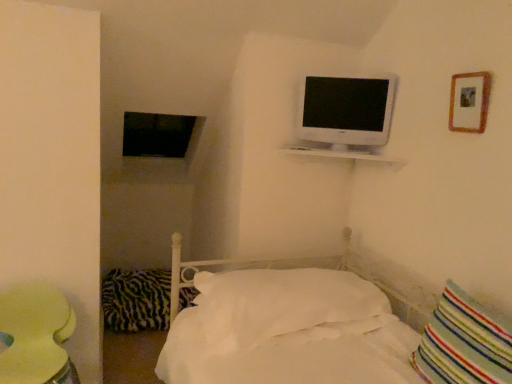
How much space does striped fabric pillow at lower right, which is the third pillow in back-to-front order, occupy horizontally?

striped fabric pillow at lower right, which is the third pillow in back-to-front order, is 8.17 inches wide.

What do you see at coordinates (285, 307) in the screenshot? I see `white soft pillow at center, placed as the second pillow when sorted from right to left` at bounding box center [285, 307].

What do you see at coordinates (469, 102) in the screenshot? I see `wooden picture frame at upper right` at bounding box center [469, 102].

What do you see at coordinates (136, 299) in the screenshot? I see `zebra-patterned fabric pillow at lower left, the third pillow when ordered from right to left` at bounding box center [136, 299].

This screenshot has width=512, height=384. What do you see at coordinates (346, 111) in the screenshot?
I see `white glossy television at upper right` at bounding box center [346, 111].

In order to click on striped fabric pillow at lower right, positioned as the first pillow in front-to-back order in this screenshot , I will do `click(464, 343)`.

Which is in front, point (380, 130) or point (351, 152)?

The point (380, 130) is closer.

From the image's perspective, is white glossy television at upper right beneath white glossy shelf at upper center?

Actually, white glossy television at upper right appears above white glossy shelf at upper center in the image.

Is white glossy television at upper right wider or thinner than white glossy shelf at upper center?

Considering their sizes, white glossy television at upper right looks slimmer than white glossy shelf at upper center.

Considering the positions of point (386, 78) and point (113, 279), is point (386, 78) closer or farther from the camera than point (113, 279)?

Clearly, point (386, 78) is closer to the camera than point (113, 279).

Can you confirm if white glossy television at upper right is smaller than zebra-patterned fabric pillow at lower left, marked as the first pillow in a left-to-right arrangement?

Indeed, white glossy television at upper right has a smaller size compared to zebra-patterned fabric pillow at lower left, marked as the first pillow in a left-to-right arrangement.

Where is `television above the zebra-patterned fabric pillow at lower left, marked as the first pillow in a left-to-right arrangement (from a real-world perspective)`? The width and height of the screenshot is (512, 384). television above the zebra-patterned fabric pillow at lower left, marked as the first pillow in a left-to-right arrangement (from a real-world perspective) is located at coordinates pyautogui.click(x=346, y=111).

Is white glossy television at upper right completely or partially outside of zebra-patterned fabric pillow at lower left, which is counted as the 1th pillow, starting from the back?

Indeed, white glossy television at upper right is completely outside zebra-patterned fabric pillow at lower left, which is counted as the 1th pillow, starting from the back.

Can white glossy television at upper right be found inside striped fabric pillow at lower right, the 1th pillow in the right-to-left sequence?

Definitely not — white glossy television at upper right is not inside striped fabric pillow at lower right, the 1th pillow in the right-to-left sequence.

Which is less distant, (476, 331) or (393, 103)?

Point (476, 331) is positioned closer to the camera compared to point (393, 103).

Considering their positions, is striped fabric pillow at lower right, which is the third pillow in back-to-front order, located in front of or behind white glossy television at upper right?

In the image, striped fabric pillow at lower right, which is the third pillow in back-to-front order, appears in front of white glossy television at upper right.

What's the angular difference between striped fabric pillow at lower right, the 1th pillow in the right-to-left sequence, and white glossy television at upper right's facing directions?

57.2 degrees.

The width and height of the screenshot is (512, 384). In order to click on pillow behind the white soft pillow at center, which ranks as the second pillow in back-to-front order in this screenshot , I will do `click(136, 299)`.

Could you tell me if zebra-patterned fabric pillow at lower left, positioned as the third pillow in front-to-back order, is facing white soft pillow at center, which is the second pillow from front to back?

No, zebra-patterned fabric pillow at lower left, positioned as the third pillow in front-to-back order, is not aimed at white soft pillow at center, which is the second pillow from front to back.

Can you tell me how much zebra-patterned fabric pillow at lower left, which is counted as the 1th pillow, starting from the back, and white soft pillow at center, which is the second pillow from front to back, differ in facing direction?

The facing directions of zebra-patterned fabric pillow at lower left, which is counted as the 1th pillow, starting from the back, and white soft pillow at center, which is the second pillow from front to back, are 88 degrees apart.

From the image's perspective, between zebra-patterned fabric pillow at lower left, the third pillow when ordered from right to left, and white soft pillow at center, which ranks as the second pillow in left-to-right order, who is located below?

zebra-patterned fabric pillow at lower left, the third pillow when ordered from right to left, is shown below in the image.

Which is more to the left, striped fabric pillow at lower right, the third pillow positioned from the left, or wooden picture frame at upper right?

striped fabric pillow at lower right, the third pillow positioned from the left.

Which of these two, striped fabric pillow at lower right, which is the third pillow in back-to-front order, or wooden picture frame at upper right, is smaller?

With smaller size is wooden picture frame at upper right.

Consider the image. From a real-world perspective, between striped fabric pillow at lower right, which is the third pillow in back-to-front order, and wooden picture frame at upper right, who is vertically higher?

From a 3D spatial view, wooden picture frame at upper right is above.

Does striped fabric pillow at lower right, which is the third pillow in back-to-front order, touch wooden picture frame at upper right?

There is a gap between striped fabric pillow at lower right, which is the third pillow in back-to-front order, and wooden picture frame at upper right.

Between white glossy television at upper right and matte yellow table at lower left, which one appears on the right side from the viewer's perspective?

Positioned to the right is white glossy television at upper right.

Is white glossy television at upper right facing away from matte yellow table at lower left?

white glossy television at upper right is not turned away from matte yellow table at lower left.

The height and width of the screenshot is (384, 512). In order to click on television that appears above the matte yellow table at lower left (from a real-world perspective) in this screenshot , I will do point(346,111).

Can matte yellow table at lower left be found inside white glossy television at upper right?

Actually, matte yellow table at lower left is outside white glossy television at upper right.

Locate an element on the screen. Image resolution: width=512 pixels, height=384 pixels. shelf directly beneath the wooden picture frame at upper right (from a real-world perspective) is located at coordinates (345, 155).

From the image's perspective, is white glossy shelf at upper center positioned above or below wooden picture frame at upper right?

white glossy shelf at upper center is below wooden picture frame at upper right.

Considering the relative sizes of white glossy shelf at upper center and wooden picture frame at upper right in the image provided, is white glossy shelf at upper center bigger than wooden picture frame at upper right?

Yes.

Identify the location of television above the white glossy shelf at upper center (from a real-world perspective). [x=346, y=111].

Locate an element on the screen. The height and width of the screenshot is (384, 512). television lying in front of the zebra-patterned fabric pillow at lower left, which is counted as the 1th pillow, starting from the back is located at coordinates (346, 111).

Based on their spatial positions, is matte yellow table at lower left or white glossy television at upper right closer to white glossy shelf at upper center?

Based on the image, white glossy television at upper right appears to be nearer to white glossy shelf at upper center.

From the image, which object appears to be nearer to white glossy shelf at upper center, white soft pillow at center, placed as the second pillow when sorted from right to left, or striped fabric pillow at lower right, which is the third pillow in back-to-front order?

white soft pillow at center, placed as the second pillow when sorted from right to left, is closer to white glossy shelf at upper center.

When comparing their distances from striped fabric pillow at lower right, the 1th pillow in the right-to-left sequence, does zebra-patterned fabric pillow at lower left, marked as the first pillow in a left-to-right arrangement, or white glossy shelf at upper center seem further?

zebra-patterned fabric pillow at lower left, marked as the first pillow in a left-to-right arrangement, is positioned further to the anchor striped fabric pillow at lower right, the 1th pillow in the right-to-left sequence.

When comparing their distances from striped fabric pillow at lower right, the third pillow positioned from the left, does wooden picture frame at upper right or matte yellow table at lower left seem further?

The object further to striped fabric pillow at lower right, the third pillow positioned from the left, is matte yellow table at lower left.

Based on their spatial positions, is matte yellow table at lower left or zebra-patterned fabric pillow at lower left, marked as the first pillow in a left-to-right arrangement, closer to white glossy television at upper right?

Based on the image, matte yellow table at lower left appears to be nearer to white glossy television at upper right.

Considering their positions, is white soft pillow at center, which is the second pillow from front to back, positioned closer to wooden picture frame at upper right than matte yellow table at lower left?

white soft pillow at center, which is the second pillow from front to back, is closer to wooden picture frame at upper right.

Based on their spatial positions, is striped fabric pillow at lower right, the third pillow positioned from the left, or white glossy shelf at upper center closer to wooden picture frame at upper right?

white glossy shelf at upper center.

Estimate the real-world distances between objects in this image. Which object is further from white glossy shelf at upper center, matte yellow table at lower left or wooden picture frame at upper right?

matte yellow table at lower left is positioned further to the anchor white glossy shelf at upper center.

I want to click on shelf between wooden picture frame at upper right and striped fabric pillow at lower right, positioned as the first pillow in front-to-back order, in the vertical direction, so click(x=345, y=155).

Image resolution: width=512 pixels, height=384 pixels. I want to click on shelf between matte yellow table at lower left and striped fabric pillow at lower right, the third pillow positioned from the left, in the horizontal direction, so click(345, 155).

You are a GUI agent. You are given a task and a screenshot of the screen. Output one action in this format:
    pyautogui.click(x=<x>, y=<y>)
    Task: Click on the pillow between striped fabric pillow at lower right, the 1th pillow in the right-to-left sequence, and zebra-patterned fabric pillow at lower left, positioned as the third pillow in front-to-back order, in the front-back direction
    The width and height of the screenshot is (512, 384).
    Given the screenshot: What is the action you would take?
    pyautogui.click(x=285, y=307)

The height and width of the screenshot is (384, 512). Identify the location of television between matte yellow table at lower left and wooden picture frame at upper right. (346, 111).